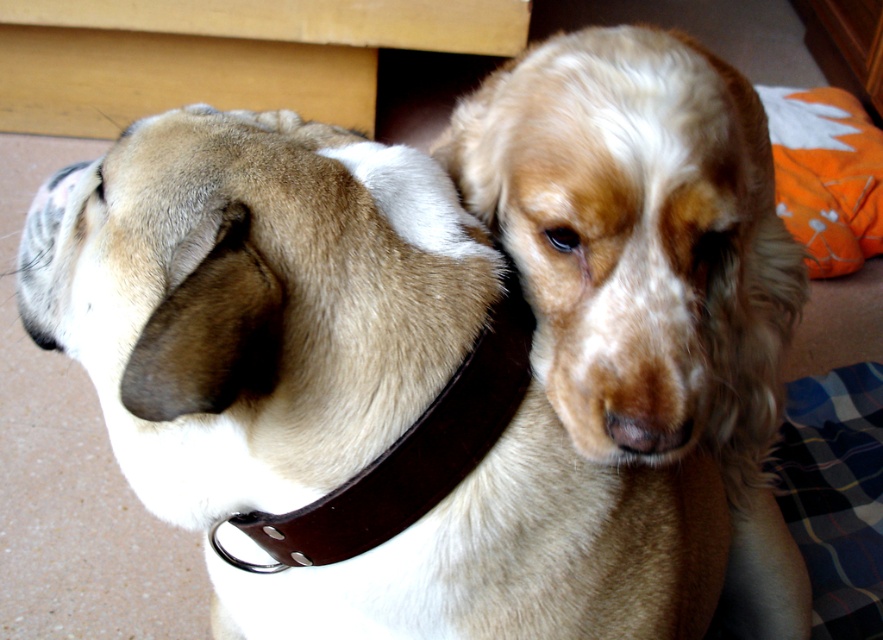
You are trying to locate the brown leather collar at upper center in the image. According to the coordinates provided, where exactly is it positioned?

The brown leather collar at upper center is located at point coordinates 0.603 in the x axis and 0.385 in the y axis.

Consider the image. You are a dog trainer observing two dogs in an indoor setting. You notice the brown leather collar at upper center and the brown leather neckband at left. Can you determine if there is enough space between them for a small dog to comfortably pass through?

The distance between the brown leather collar at upper center and the brown leather neckband at left is 4.64 inches, which is sufficient for a small dog to comfortably pass through.

You are a dog owner who wants to put a collar on your dog. You have two options in the image, the brown leather collar at upper center and the brown leather neckband at left. Which one is positioned to the left of the other?

The brown leather collar at upper center is to the left of the brown leather neckband at left.